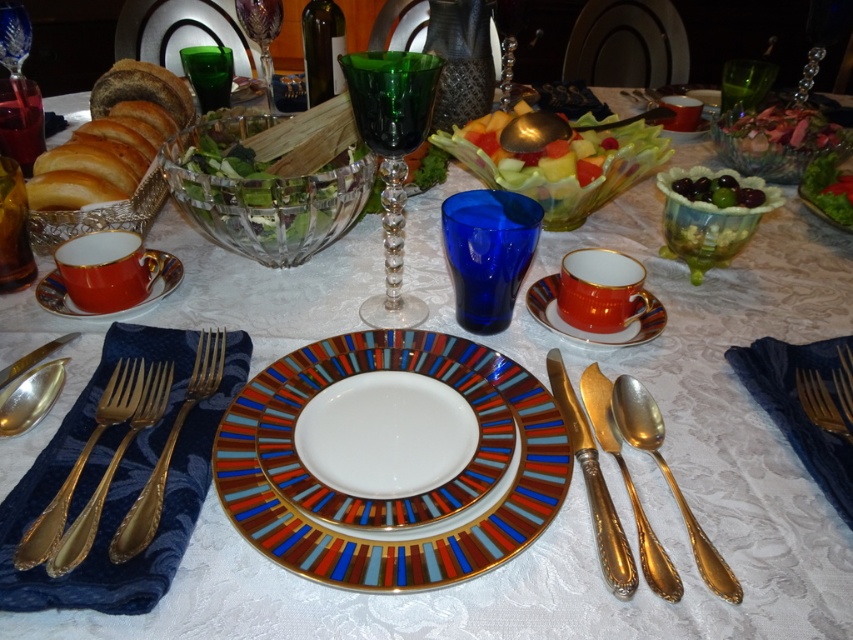
Who is taller, multicolored glass platter at center or green glossy grapes at upper right?

multicolored glass platter at center

Does multicolored glass platter at center come in front of green glossy grapes at upper right?

Yes, multicolored glass platter at center is in front of green glossy grapes at upper right.

Image resolution: width=853 pixels, height=640 pixels. What do you see at coordinates (399, 497) in the screenshot?
I see `multicolored glass platter at center` at bounding box center [399, 497].

Identify the location of multicolored glass platter at center. Image resolution: width=853 pixels, height=640 pixels. (399, 497).

Which of these two, multicolored glass platter at center or translucent plastic salad at center, stands shorter?

Standing shorter between the two is multicolored glass platter at center.

Which is more to the right, multicolored glass platter at center or translucent plastic salad at center?

translucent plastic salad at center

Locate an element on the screen. multicolored glass platter at center is located at coordinates (399, 497).

Who is positioned more to the right, green crystal wine glass at upper center or clear crystal wine glass at upper left?

green crystal wine glass at upper center is more to the right.

Measure the distance from green crystal wine glass at upper center to clear crystal wine glass at upper left.

green crystal wine glass at upper center is 11.57 inches from clear crystal wine glass at upper left.

Who is more forward, (245, 33) or (10, 52)?

Positioned in front is point (10, 52).

You are a GUI agent. You are given a task and a screenshot of the screen. Output one action in this format:
    pyautogui.click(x=<x>, y=<y>)
    Task: Click on the green crystal wine glass at upper center
    This screenshot has width=853, height=640.
    Given the screenshot: What is the action you would take?
    pyautogui.click(x=260, y=33)